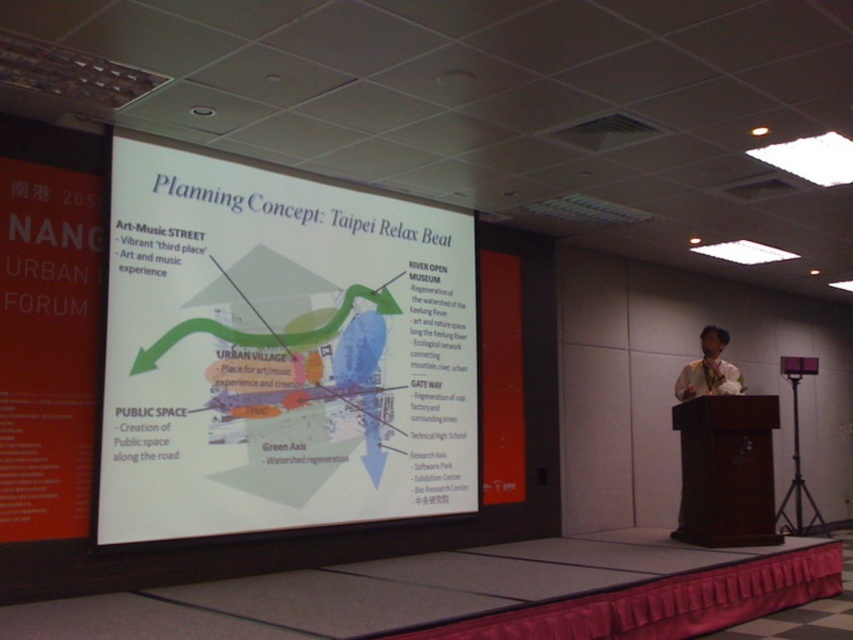
You are an attendee at the presentation and need to take notes. The white paper at center is on the table, and the brown wooden podium at right is where the presenter is standing. Which object is bigger in size?

The white paper at center has a larger size compared to the brown wooden podium at right.

From the picture: You are an attendee at the presentation. You want to take a photo of the projection screen but need to ensure you can see it clearly without obstruction. Considering the brown wooden podium at right and the matte white shirt at right, which object is closer to you and might block your view?

The brown wooden podium at right is in front of the matte white shirt at right, so the podium is closer to you and might block your view.